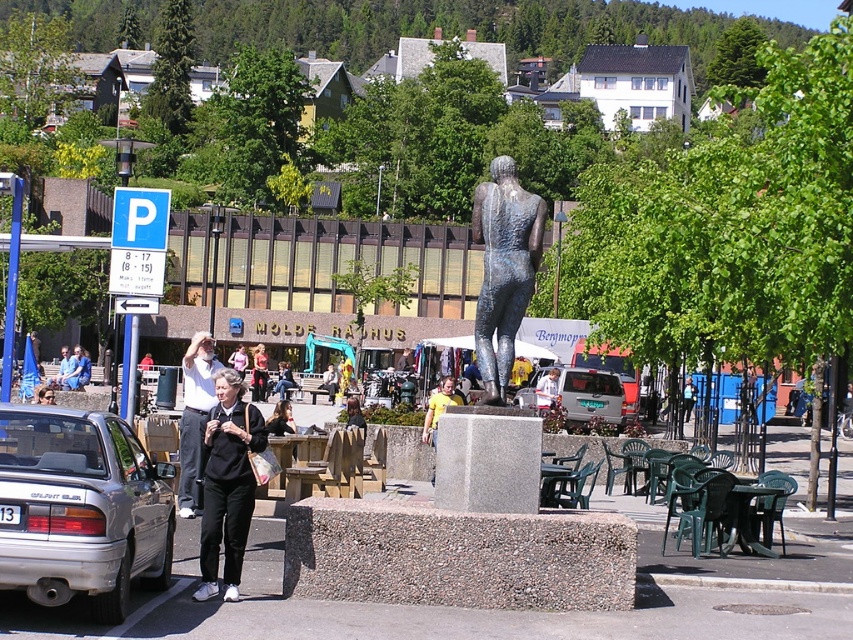
Does silver metallic car at lower left have a lesser width compared to matte silver van at center?

Yes, silver metallic car at lower left is thinner than matte silver van at center.

Is point (42, 570) farther from camera compared to point (582, 410)?

No, (42, 570) is closer to viewer.

At what (x,y) coordinates should I click in order to perform the action: click on silver metallic car at lower left. Please return your answer as a coordinate pair (x, y). Looking at the image, I should click on (80, 508).

Between silver metallic car at lower left and light gray pants at center, which one has less height?

silver metallic car at lower left

Can you confirm if silver metallic car at lower left is positioned below light gray pants at center?

Yes.

Is point (12, 404) positioned in front of point (206, 353)?

Yes, point (12, 404) is closer to viewer.

Find the location of a particular element. The width and height of the screenshot is (853, 640). silver metallic car at lower left is located at coordinates (80, 508).

Based on the photo, does shiny bronze statue at center have a greater height compared to matte silver van at center?

Correct, shiny bronze statue at center is much taller as matte silver van at center.

Can you confirm if shiny bronze statue at center is positioned above matte silver van at center?

Yes, shiny bronze statue at center is above matte silver van at center.

Which is behind, point (476, 348) or point (592, 387)?

The point (592, 387) is behind.

At what (x,y) coordinates should I click in order to perform the action: click on shiny bronze statue at center. Please return your answer as a coordinate pair (x, y). The image size is (853, 640). Looking at the image, I should click on (503, 269).